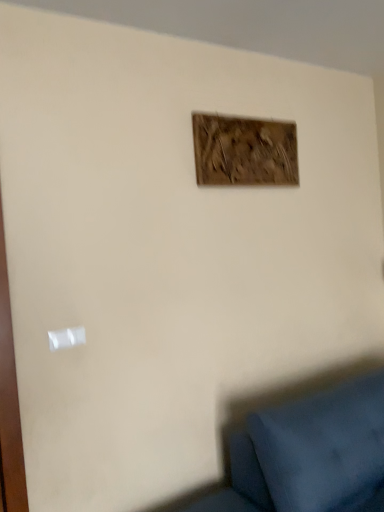
What do you see at coordinates (66, 338) in the screenshot?
I see `white plastic light switch at lower left` at bounding box center [66, 338].

Image resolution: width=384 pixels, height=512 pixels. Find the location of `white plastic light switch at lower left`. white plastic light switch at lower left is located at coordinates (66, 338).

What do you see at coordinates (244, 151) in the screenshot? The width and height of the screenshot is (384, 512). I see `wooden frame at upper center` at bounding box center [244, 151].

Identify the location of wooden frame at upper center. (244, 151).

The height and width of the screenshot is (512, 384). I want to click on white plastic light switch at lower left, so click(66, 338).

Considering the relative positions of wooden frame at upper center and white plastic light switch at lower left in the image provided, is wooden frame at upper center to the right of white plastic light switch at lower left from the viewer's perspective?

Yes, wooden frame at upper center is to the right of white plastic light switch at lower left.

Considering their positions, is wooden frame at upper center located in front of or behind white plastic light switch at lower left?

wooden frame at upper center is positioned farther from the viewer than white plastic light switch at lower left.

Does point (271, 134) come in front of point (51, 343)?

No, it is behind (51, 343).

From the image's perspective, which object appears higher, wooden frame at upper center or white plastic light switch at lower left?

From the image's view, wooden frame at upper center is above.

From a real-world perspective, is wooden frame at upper center beneath white plastic light switch at lower left?

No, from a real-world perspective, wooden frame at upper center is not below white plastic light switch at lower left.

Is wooden frame at upper center wider or thinner than white plastic light switch at lower left?

In the image, wooden frame at upper center appears to be wider than white plastic light switch at lower left.

Considering the sizes of objects wooden frame at upper center and white plastic light switch at lower left in the image provided, who is taller, wooden frame at upper center or white plastic light switch at lower left?

wooden frame at upper center is taller.

Based on the photo, between wooden frame at upper center and white plastic light switch at lower left, which one has smaller size?

white plastic light switch at lower left is smaller.

Would you say wooden frame at upper center is outside white plastic light switch at lower left?

Yes, wooden frame at upper center is located beyond the bounds of white plastic light switch at lower left.

In the scene shown: Can you see wooden frame at upper center touching white plastic light switch at lower left?

No, wooden frame at upper center is not making contact with white plastic light switch at lower left.

Is wooden frame at upper center looking in the opposite direction of white plastic light switch at lower left?

No, white plastic light switch at lower left is not at the back of wooden frame at upper center.

Where is `picture frame that appears on the right of white plastic light switch at lower left`? picture frame that appears on the right of white plastic light switch at lower left is located at coordinates (x=244, y=151).

Does white plastic light switch at lower left appear on the right side of wooden frame at upper center?

No.

Which object is more forward, white plastic light switch at lower left or wooden frame at upper center?

Positioned in front is white plastic light switch at lower left.

Considering the points (78, 336) and (204, 129), which point is in front, point (78, 336) or point (204, 129)?

The point (78, 336) is more forward.

From the image's perspective, would you say white plastic light switch at lower left is positioned over wooden frame at upper center?

No, from the image's perspective, white plastic light switch at lower left is not on top of wooden frame at upper center.

From a real-world perspective, is white plastic light switch at lower left over wooden frame at upper center?

No, from a real-world perspective, white plastic light switch at lower left is not on top of wooden frame at upper center.

Looking at their sizes, would you say white plastic light switch at lower left is wider or thinner than wooden frame at upper center?

white plastic light switch at lower left is thinner than wooden frame at upper center.

Considering the sizes of objects white plastic light switch at lower left and wooden frame at upper center in the image provided, who is taller, white plastic light switch at lower left or wooden frame at upper center?

Answer: Standing taller between the two is wooden frame at upper center.

Between white plastic light switch at lower left and wooden frame at upper center, which one has smaller size?

Smaller between the two is white plastic light switch at lower left.

Can wooden frame at upper center be found inside white plastic light switch at lower left?

No, wooden frame at upper center is not surrounded by white plastic light switch at lower left.

Is the surface of white plastic light switch at lower left in direct contact with wooden frame at upper center?

No, white plastic light switch at lower left is not next to wooden frame at upper center.

Is white plastic light switch at lower left oriented towards wooden frame at upper center?

No, white plastic light switch at lower left is not aimed at wooden frame at upper center.

What's the angular difference between white plastic light switch at lower left and wooden frame at upper center's facing directions?

The angle between the facing direction of white plastic light switch at lower left and the facing direction of wooden frame at upper center is 0.175 degrees.

Identify the location of picture frame on the right of white plastic light switch at lower left. This screenshot has height=512, width=384. (244, 151).

You are a GUI agent. You are given a task and a screenshot of the screen. Output one action in this format:
    pyautogui.click(x=<x>, y=<y>)
    Task: Click on the picture frame above the white plastic light switch at lower left (from the image's perspective)
    This screenshot has width=384, height=512.
    Given the screenshot: What is the action you would take?
    pyautogui.click(x=244, y=151)

Where is `light switch located underneath the wooden frame at upper center (from a real-world perspective)`? light switch located underneath the wooden frame at upper center (from a real-world perspective) is located at coordinates (66, 338).